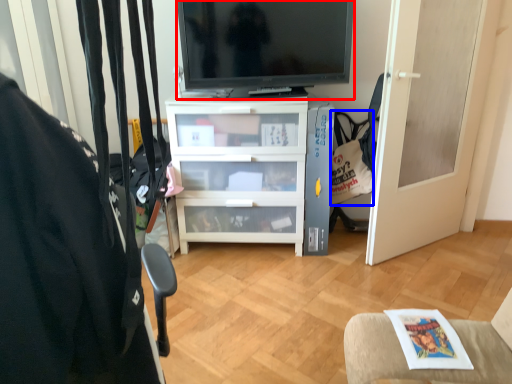
Question: Which object appears farthest to the camera in this image, television (highlighted by a red box) or handbag (highlighted by a blue box)?

Choices:
 (A) television
 (B) handbag

Answer: (B)